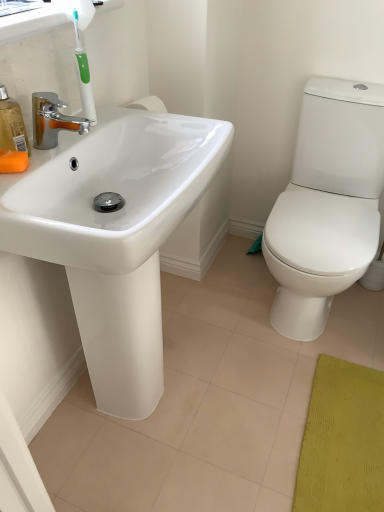
Question: Considering the positions of point (26, 141) and point (380, 281), is point (26, 141) closer or farther from the camera than point (380, 281)?

Choices:
 (A) farther
 (B) closer

Answer: (B)

Question: From the image's perspective, relative to white matte toilet paper at right, is translucent orange soap dispenser at left above or below?

Choices:
 (A) below
 (B) above

Answer: (B)

Question: Estimate the real-world distances between objects in this image. Which object is farther from the white matte toilet paper at right?

Choices:
 (A) white glossy sink at left
 (B) orange matte soap at left
 (C) translucent orange soap dispenser at left

Answer: (B)

Question: Which is nearer to the white glossy sink at left?

Choices:
 (A) white matte toilet paper at right
 (B) translucent orange soap dispenser at left
 (C) orange matte soap at left

Answer: (C)